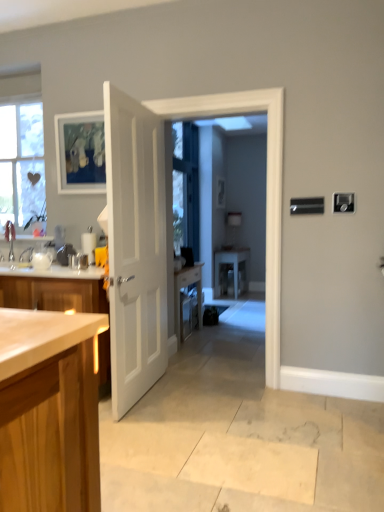
Question: Is clear glass window screen at center inside the boundaries of white glossy table at center, or outside?

Choices:
 (A) outside
 (B) inside

Answer: (A)

Question: From the image's perspective, is clear glass window screen at center above or below white glossy table at center?

Choices:
 (A) below
 (B) above

Answer: (B)

Question: Which object is the closest to the white glossy door at center?

Choices:
 (A) clear glass window screen at center
 (B) white matte door at center
 (C) white glossy table at center
 (D) matte wooden picture frame at upper left

Answer: (B)

Question: Based on their relative distances, which object is farther from the white matte door at center?

Choices:
 (A) matte wooden picture frame at upper left
 (B) white glossy door at center
 (C) clear glass window screen at center
 (D) white glossy table at center

Answer: (D)